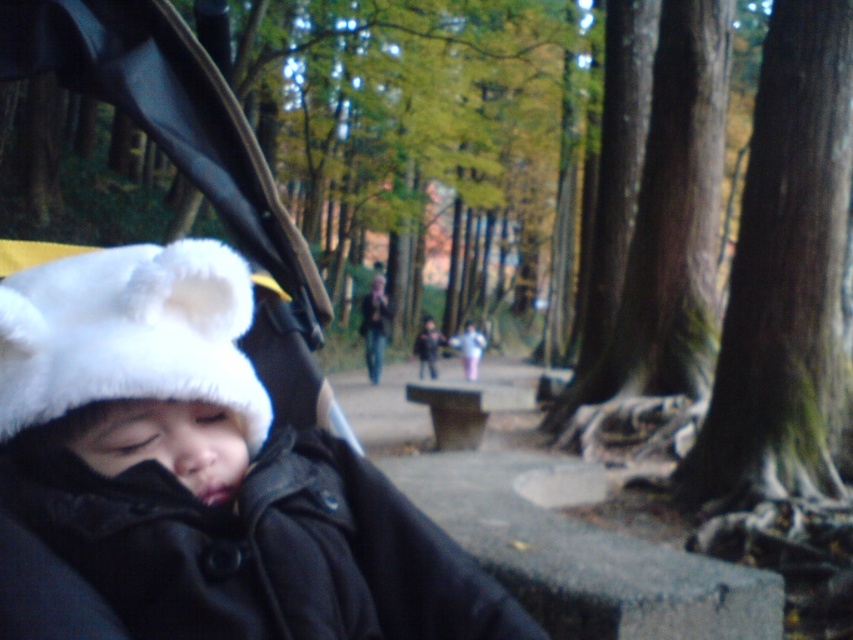
In the scene shown: You are standing at the center of the image and want to find the point located at coordinates (x=259, y=548). Which object is this point on?

The point located at coordinates (x=259, y=548) is on the black matte jacket at left.

You are a parent trying to push the black fabric baby carriage at center through a narrow path. There is a white furry hat at left in your way. Can you move the baby carriage without disturbing the hat?

The black fabric baby carriage at center is positioned over white furry hat at left, so you cannot move the baby carriage without disturbing the hat since it is directly on top of it.

You are a photographer standing 40 inches away from the black fabric baby carriage at center. Can you safely take a photo without moving closer than 38.88 inches?

The black fabric baby carriage at center is 38.88 inches away from the camera, so if you are standing 40 inches away, you are actually further away than the carriage. Therefore, you can safely take a photo without moving closer than 38.88 inches.